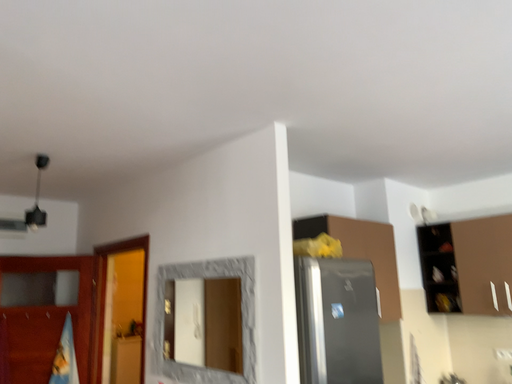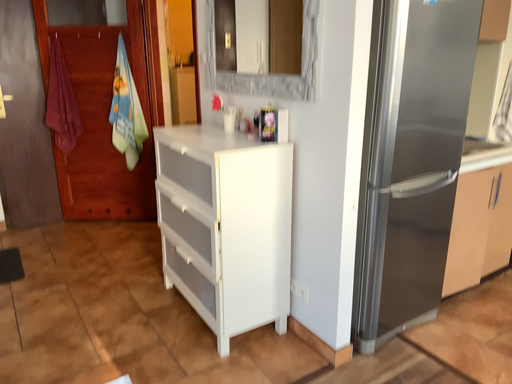
Question: Which way did the camera rotate in the video?

Choices:
 (A) rotated right
 (B) rotated left

Answer: (B)